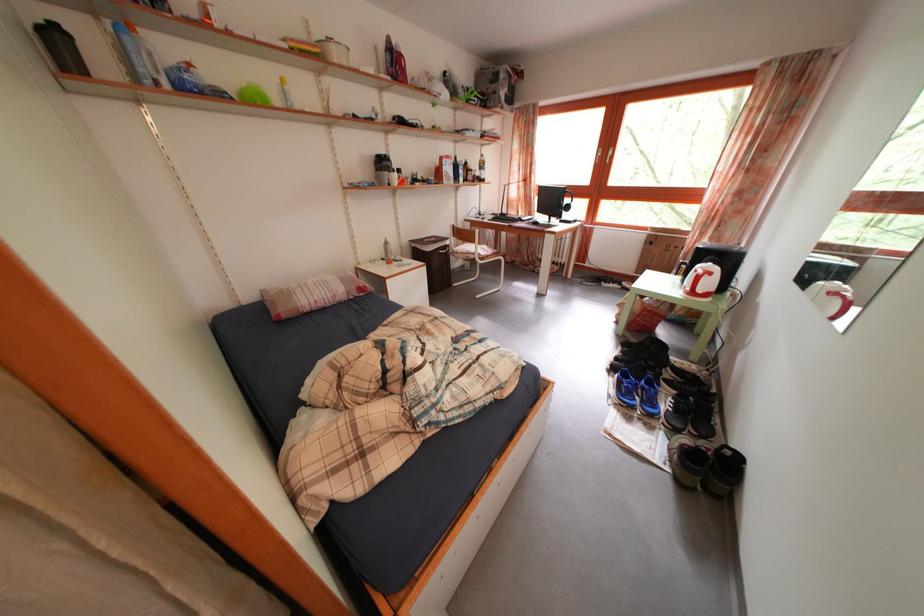
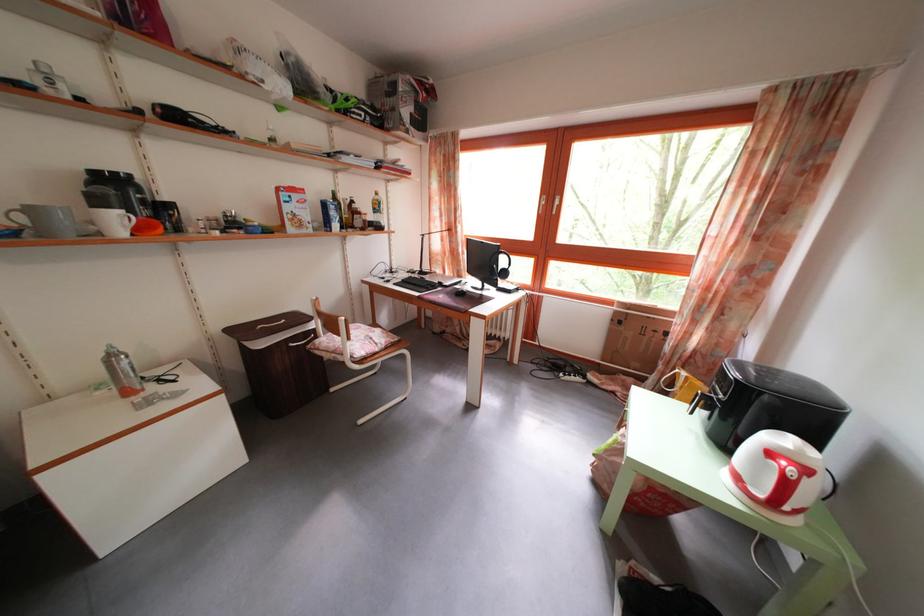
Locate, in the second image, the point that corresponds to (x=416, y=272) in the first image.

(185, 402)